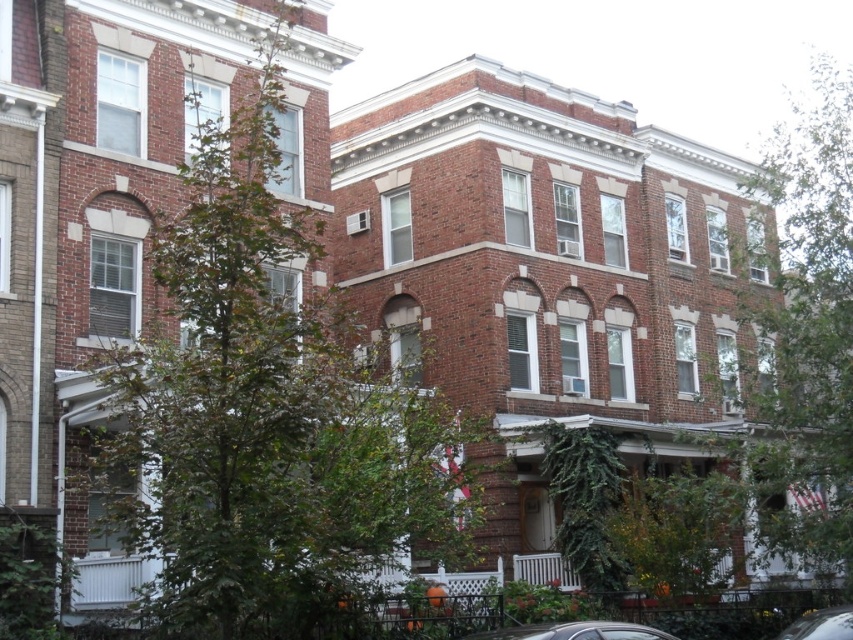
Who is taller, green leafy tree at center or metallic silver car at lower right?

green leafy tree at center is taller.

Is green leafy tree at center smaller than metallic silver car at lower right?

Incorrect, green leafy tree at center is not smaller in size than metallic silver car at lower right.

The image size is (853, 640). What are the coordinates of `green leafy tree at center` in the screenshot? It's located at (270, 413).

Is green leafy tree at center below green leafy tree at right?

Yes, green leafy tree at center is below green leafy tree at right.

Between point (325, 372) and point (756, 376), which one is positioned behind?

The point (756, 376) is more distant.

Locate an element on the screen. green leafy tree at center is located at coordinates (270, 413).

How distant is green leafy tree at center from metallic silver car at center?

green leafy tree at center and metallic silver car at center are 11.27 meters apart from each other.

The image size is (853, 640). I want to click on green leafy tree at center, so click(x=270, y=413).

Who is more forward, (x=274, y=108) or (x=596, y=634)?

Point (x=596, y=634)

Where is `green leafy tree at center`? green leafy tree at center is located at coordinates (270, 413).